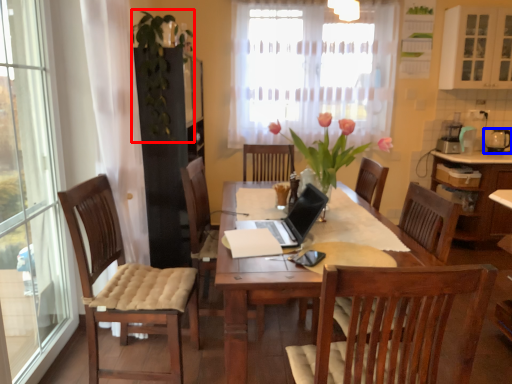
Question: Which point is further to the camera, floral arrangement (highlighted by a red box) or tableware (highlighted by a blue box)?

Choices:
 (A) floral arrangement
 (B) tableware

Answer: (B)